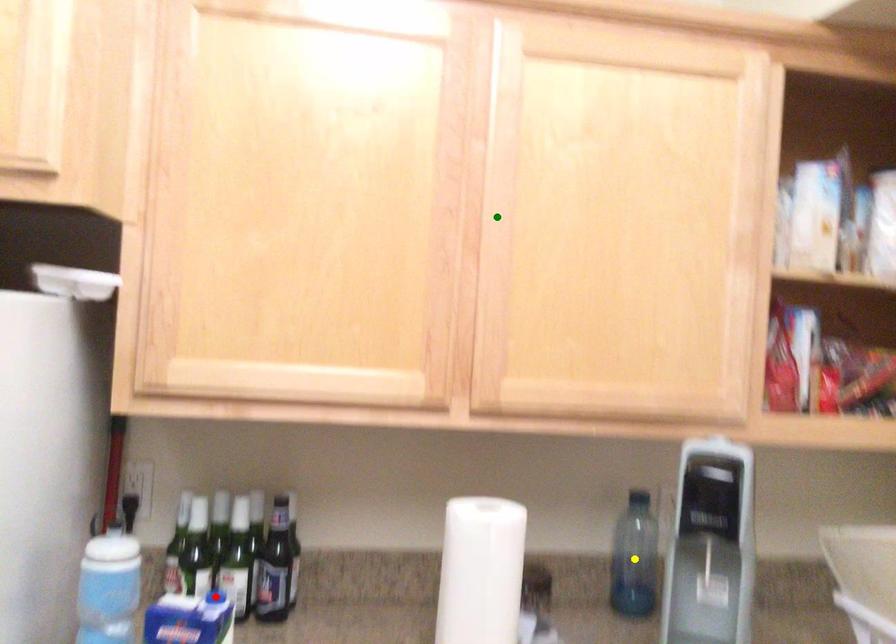
Order these from farthest to nearest:
red point | yellow point | green point

yellow point, green point, red point